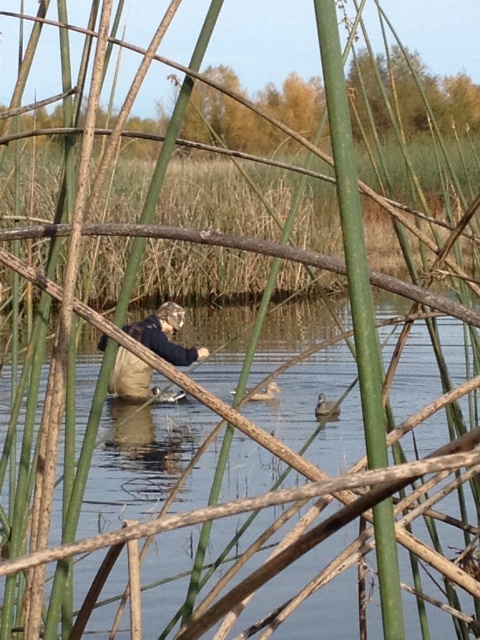
You are standing at the edge of the water in the scene. There is a point marked at coordinates (262, 499) which is clear water at center. If you want to find the clearest part of the water to take a photo, where should you walk to?

The clearest part of the water is at the point marked (262, 499), which is the clear water at center. You should walk towards that central point to take your photo.

You are standing on the edge of a lake and see the clear water at center and the white matte duck at center. Which one appears bigger in the scene?

The clear water at center appears bigger than the white matte duck at center because it has a larger size compared to the white matte duck at center.

You are standing on the bank of the lake and want to feed the ducks. The person in the image is wading in the clear water at center. There are two ducks in the water. One duck is closer to the person and the other is farther away. How far apart are the two ducks from each other?

The two ducks are 24.45 inches apart.